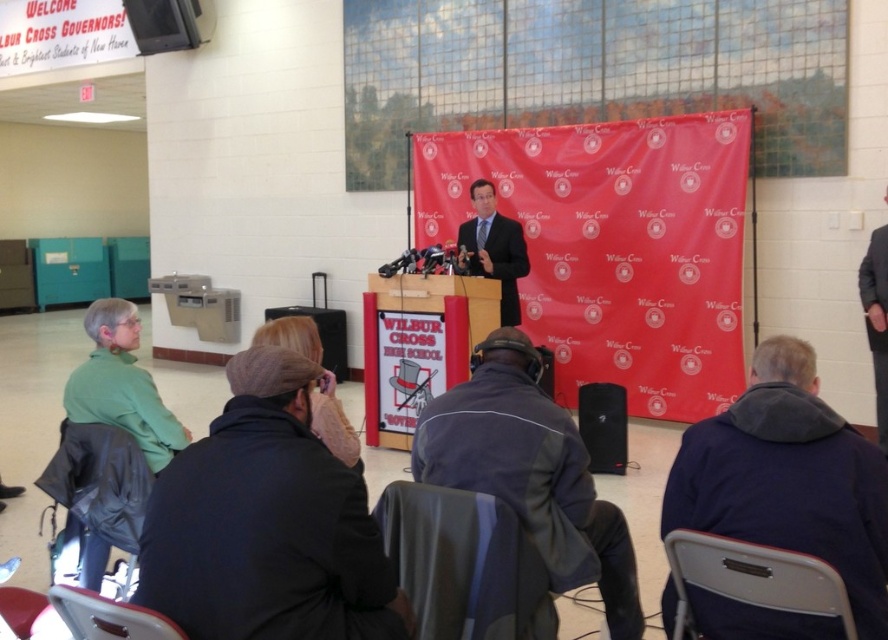
Question: Does dark gray fabric chair at lower left have a smaller size compared to metallic gray chair at lower right?

Choices:
 (A) yes
 (B) no

Answer: (B)

Question: From the image, what is the correct spatial relationship of green matte shirt at left in relation to smooth brown leather jacket at center?

Choices:
 (A) below
 (B) above

Answer: (A)

Question: Is gray suit at right bigger than smooth brown leather jacket at center?

Choices:
 (A) yes
 (B) no

Answer: (B)

Question: Estimate the real-world distances between objects in this image. Which object is farther from the smooth brown leather jacket at center?

Choices:
 (A) dark gray fabric jacket at lower center
 (B) metallic gray chair at lower right

Answer: (B)

Question: Which object is the closest to the matte black suit at center?

Choices:
 (A) dark blue jacket at lower right
 (B) dark gray fabric jacket at lower center

Answer: (B)

Question: Which object appears farthest from the camera in this image?

Choices:
 (A) black matte speaker at lower center
 (B) smooth brown leather jacket at center
 (C) matte black suit at center

Answer: (B)